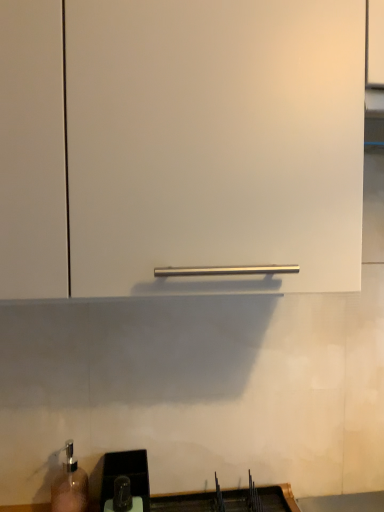
Question: From the image's perspective, would you say black plastic sink at lower center is shown under white matte cabinet handle at center?

Choices:
 (A) yes
 (B) no

Answer: (A)

Question: Can you confirm if black plastic sink at lower center is taller than white matte cabinet handle at center?

Choices:
 (A) no
 (B) yes

Answer: (A)

Question: Considering the relative sizes of black plastic sink at lower center and white matte cabinet handle at center in the image provided, is black plastic sink at lower center bigger than white matte cabinet handle at center?

Choices:
 (A) yes
 (B) no

Answer: (B)

Question: From a real-world perspective, is black plastic sink at lower center physically above white matte cabinet handle at center?

Choices:
 (A) no
 (B) yes

Answer: (A)

Question: Can you confirm if black plastic sink at lower center is positioned to the left of white matte cabinet handle at center?

Choices:
 (A) yes
 (B) no

Answer: (A)

Question: Is black plastic sink at lower center positioned with its back to white matte cabinet handle at center?

Choices:
 (A) yes
 (B) no

Answer: (B)

Question: Considering the relative sizes of white matte cabinet handle at center and black plastic sink at lower center in the image provided, is white matte cabinet handle at center taller than black plastic sink at lower center?

Choices:
 (A) no
 (B) yes

Answer: (B)

Question: Does white matte cabinet handle at center have a lesser height compared to black plastic sink at lower center?

Choices:
 (A) no
 (B) yes

Answer: (A)

Question: Considering the relative positions of white matte cabinet handle at center and black plastic sink at lower center in the image provided, is white matte cabinet handle at center behind black plastic sink at lower center?

Choices:
 (A) yes
 (B) no

Answer: (B)

Question: Can you confirm if white matte cabinet handle at center is thinner than black plastic sink at lower center?

Choices:
 (A) no
 (B) yes

Answer: (A)

Question: Could you tell me if white matte cabinet handle at center is turned towards black plastic sink at lower center?

Choices:
 (A) yes
 (B) no

Answer: (B)

Question: From a real-world perspective, is white matte cabinet handle at center beneath black plastic sink at lower center?

Choices:
 (A) no
 (B) yes

Answer: (A)

Question: Considering the positions of white matte cabinet handle at center and black plastic sink at lower center in the image, is white matte cabinet handle at center taller or shorter than black plastic sink at lower center?

Choices:
 (A) short
 (B) tall

Answer: (B)